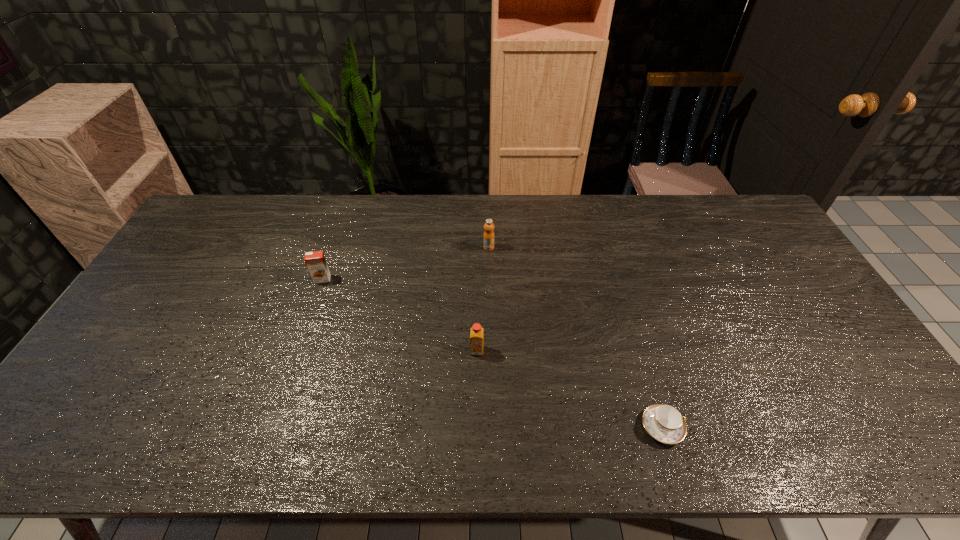
What are the coordinates of `vacant area between the third object from right to left and the shortest object` in the screenshot? It's located at (569, 389).

Where is `vacant space in between the teacup and the second object from right to left`? This screenshot has height=540, width=960. vacant space in between the teacup and the second object from right to left is located at coordinates (575, 337).

Where is `vacant point located between the second object from left to right and the leftmost orange juice`? This screenshot has width=960, height=540. vacant point located between the second object from left to right and the leftmost orange juice is located at coordinates (399, 315).

Locate an element on the screen. The image size is (960, 540). free space between the shortest object and the farthest object is located at coordinates (575, 337).

Image resolution: width=960 pixels, height=540 pixels. I want to click on free area in between the farthest orange juice and the nearest object, so click(x=575, y=337).

Identify the location of free space between the teacup and the second object from left to right. (569, 389).

This screenshot has height=540, width=960. I want to click on unoccupied position between the third farthest object and the rightmost orange juice, so click(x=483, y=299).

Locate an element on the screen. The width and height of the screenshot is (960, 540). blank region between the nearest orange juice and the nearest object is located at coordinates (569, 389).

At what (x,y) coordinates should I click in order to perform the action: click on free space between the leftmost orange juice and the second object from left to right. Please return your answer as a coordinate pair (x, y). The image size is (960, 540). Looking at the image, I should click on (399, 315).

Find the location of a particular element. The image size is (960, 540). object that is the third closest to the second nearest object is located at coordinates (315, 261).